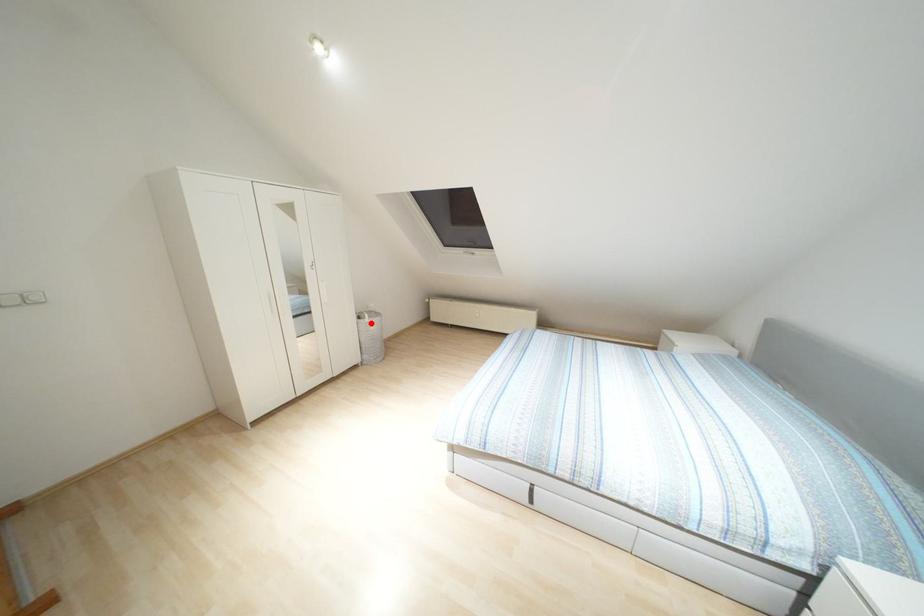
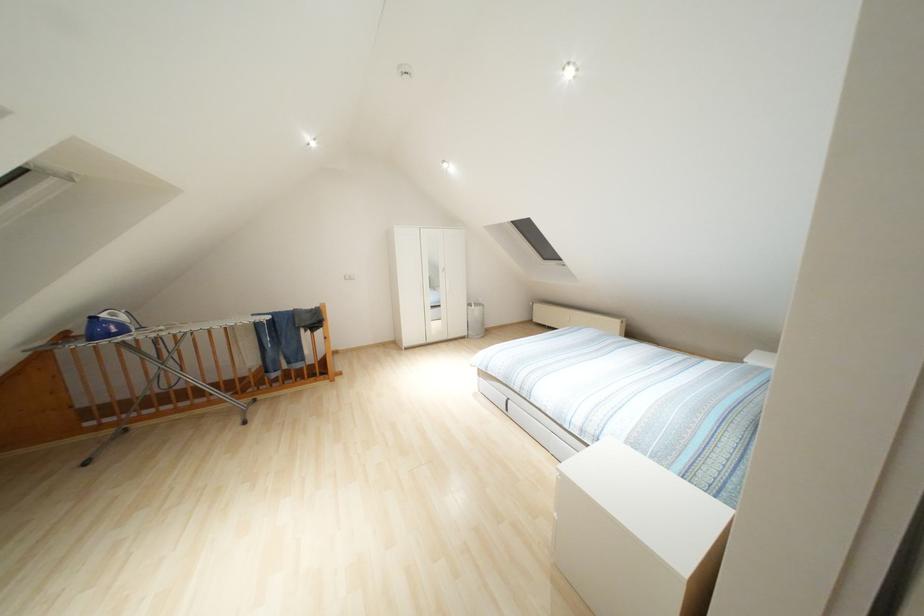
In the second image, find the point that corresponds to the highlighted location in the first image.

(476, 310)